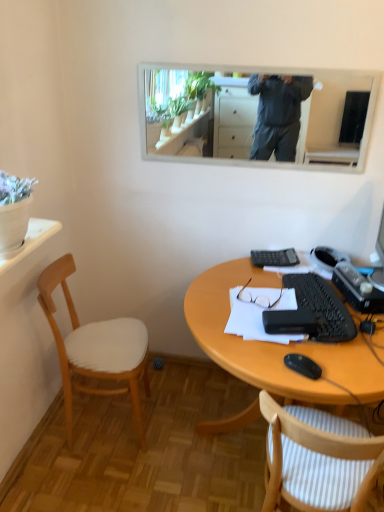
Image resolution: width=384 pixels, height=512 pixels. In order to click on vacant space to the right of wooden chair with white cushion at left, which is counted as the 1th chair, starting from the left in this screenshot , I will do `click(182, 425)`.